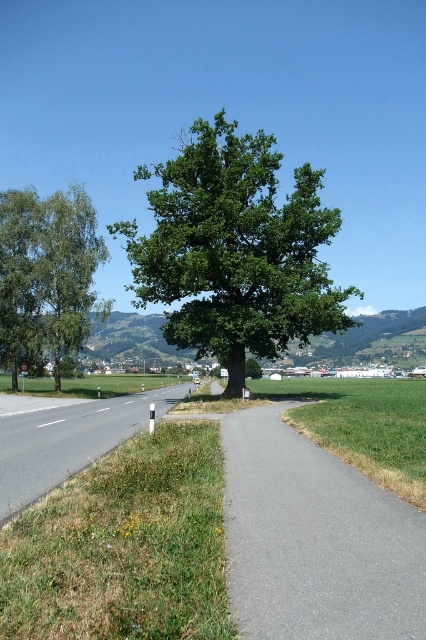
Question: Is gray asphalt path at center to the right of green grass at lower left from the viewer's perspective?

Choices:
 (A) no
 (B) yes

Answer: (B)

Question: Is green leafy tree at center thinner than green matte tree at left?

Choices:
 (A) no
 (B) yes

Answer: (A)

Question: Is gray asphalt path at center thinner than green matte tree at left?

Choices:
 (A) yes
 (B) no

Answer: (A)

Question: Among these points, which one is farthest from the camera?

Choices:
 (A) (221, 298)
 (B) (85, 214)
 (C) (29, 406)

Answer: (B)

Question: Which of these objects is positioned farthest from the green matte tree at left?

Choices:
 (A) gray asphalt path at center
 (B) green grass at lower left

Answer: (A)

Question: Which of the following is the farthest from the observer?

Choices:
 (A) green leafy tree at center
 (B) gray asphalt path at center

Answer: (A)